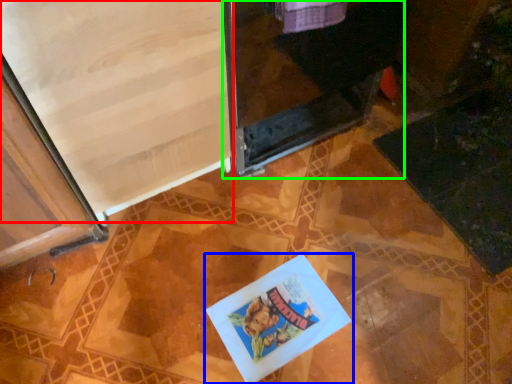
Question: Which object is the closest to the screen door (highlighted by a red box)? Choose among these: book (highlighted by a blue box) or screen door (highlighted by a green box).

Choices:
 (A) book
 (B) screen door

Answer: (B)